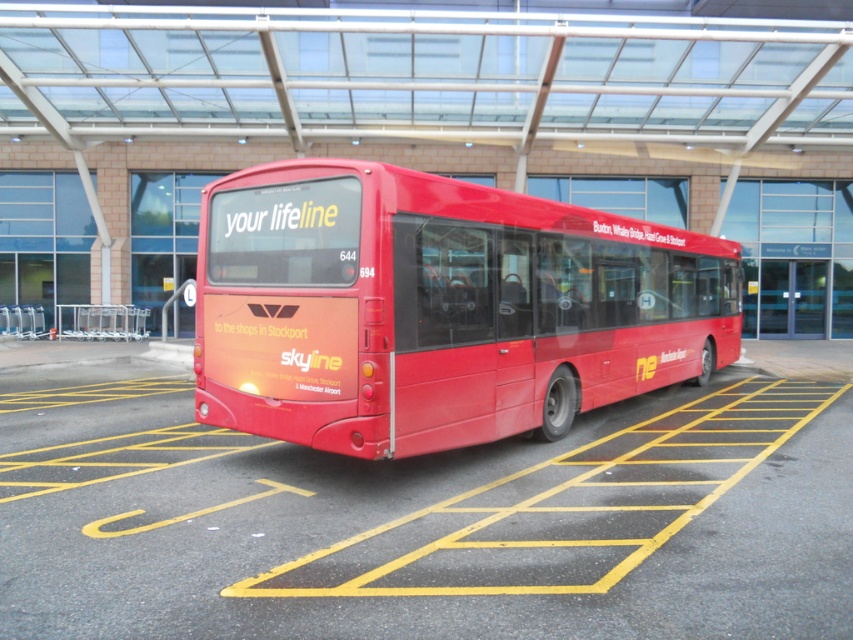
Is smooth asphalt parking lot at center above matte red bus at center?

Incorrect, smooth asphalt parking lot at center is not positioned above matte red bus at center.

Does point (737, 465) come behind point (334, 244)?

Yes, point (737, 465) is behind point (334, 244).

Describe the element at coordinates (425, 515) in the screenshot. I see `smooth asphalt parking lot at center` at that location.

Locate an element on the screen. Image resolution: width=853 pixels, height=640 pixels. smooth asphalt parking lot at center is located at coordinates (425, 515).